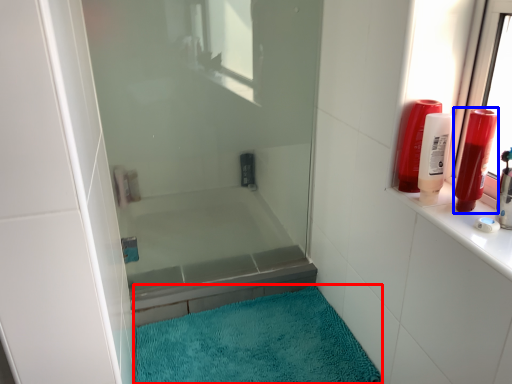
Question: Among these objects, which one is nearest to the camera, bath mat (highlighted by a red box) or toiletry (highlighted by a blue box)?

Choices:
 (A) bath mat
 (B) toiletry

Answer: (B)